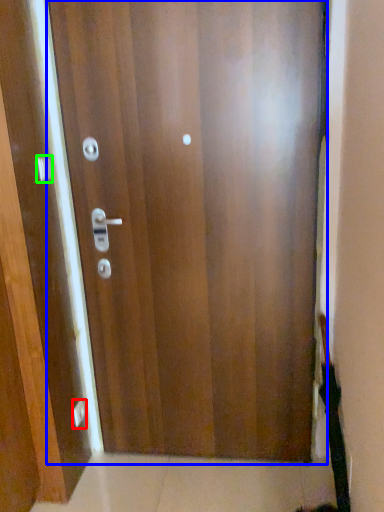
Question: Considering the real-world distances, which object is closest to knob (highlighted by a red box)? door (highlighted by a blue box) or handle (highlighted by a green box).

Choices:
 (A) door
 (B) handle

Answer: (B)